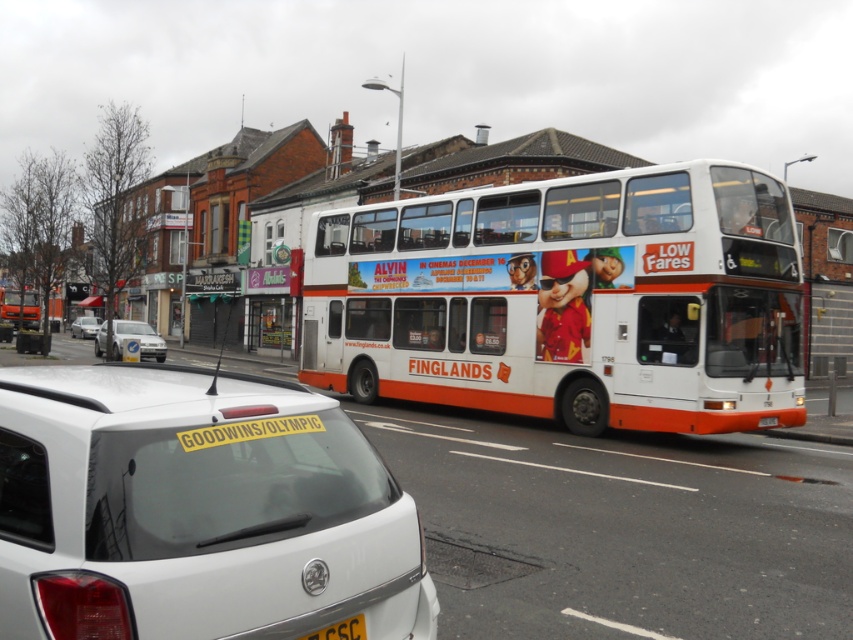
Can you confirm if white plastic bus at center is smaller than yellow matte license plate at center?

Actually, white plastic bus at center might be larger than yellow matte license plate at center.

Is the position of white plastic bus at center more distant than that of yellow matte license plate at center?

Yes.

Image resolution: width=853 pixels, height=640 pixels. I want to click on white plastic bus at center, so click(x=20, y=307).

Identify the location of white plastic bus at center. This screenshot has width=853, height=640. (x=20, y=307).

Measure the distance between white matte/deck bus at center and camera.

white matte/deck bus at center and camera are 37.24 feet apart from each other.

Is point (502, 304) closer to viewer compared to point (80, 317)?

Yes, point (502, 304) is in front of point (80, 317).

Locate an element on the screen. This screenshot has width=853, height=640. white matte/deck bus at center is located at coordinates (567, 300).

Does white matte van at left come behind white matte sedan at center?

No, white matte van at left is in front of white matte sedan at center.

Does white matte van at left have a greater height compared to white matte sedan at center?

Yes.

Who is more distant from viewer, (152, 353) or (97, 321)?

Positioned behind is point (97, 321).

In order to click on white matte van at left in this screenshot , I will do `click(137, 339)`.